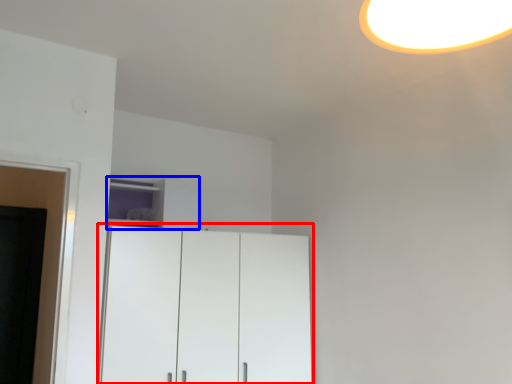
Question: Which object appears farthest to the camera in this image, cupboard (highlighted by a red box) or cabinetry (highlighted by a blue box)?

Choices:
 (A) cupboard
 (B) cabinetry

Answer: (B)